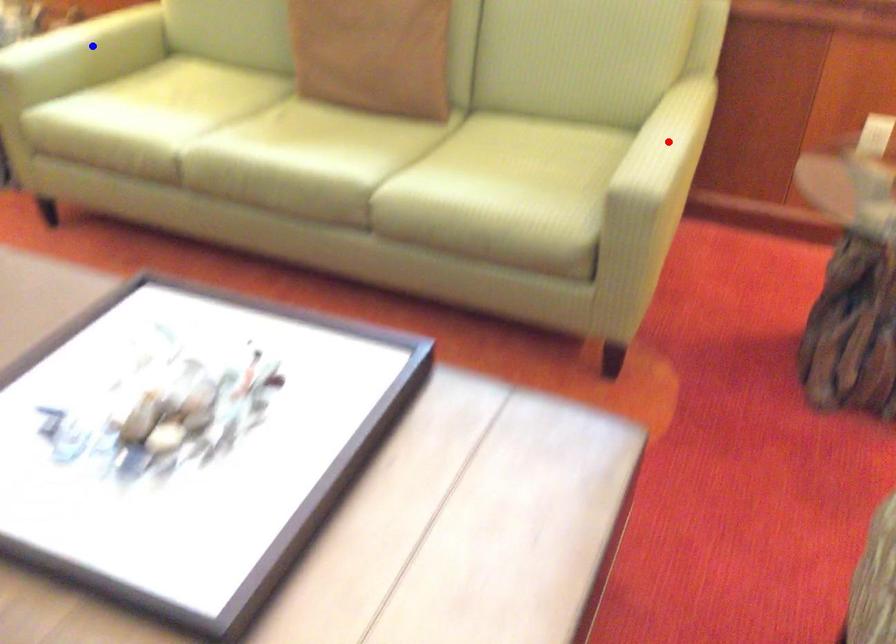
Question: In the image, two points are highlighted. Which point is nearer to the camera? Reply with the corresponding letter.

Choices:
 (A) blue point
 (B) red point

Answer: (B)